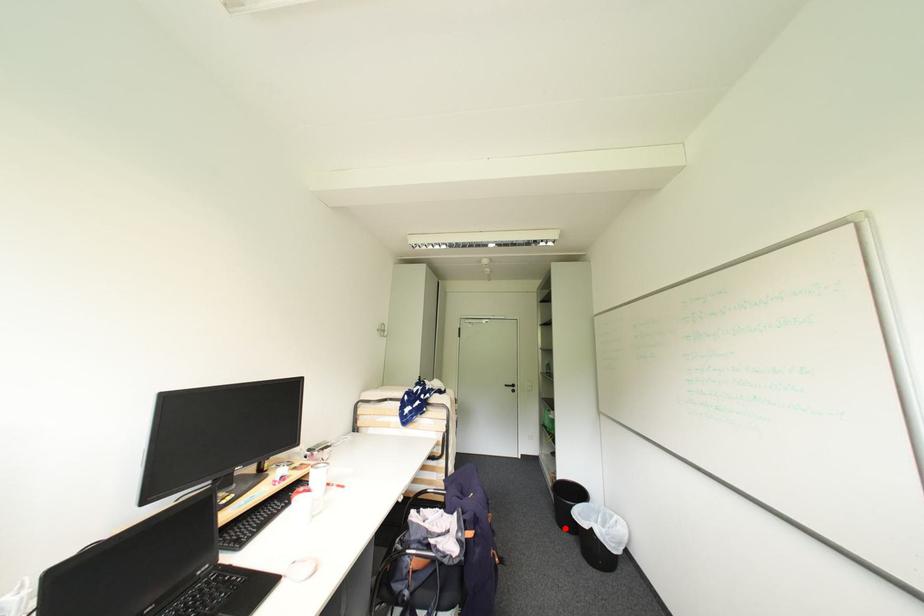
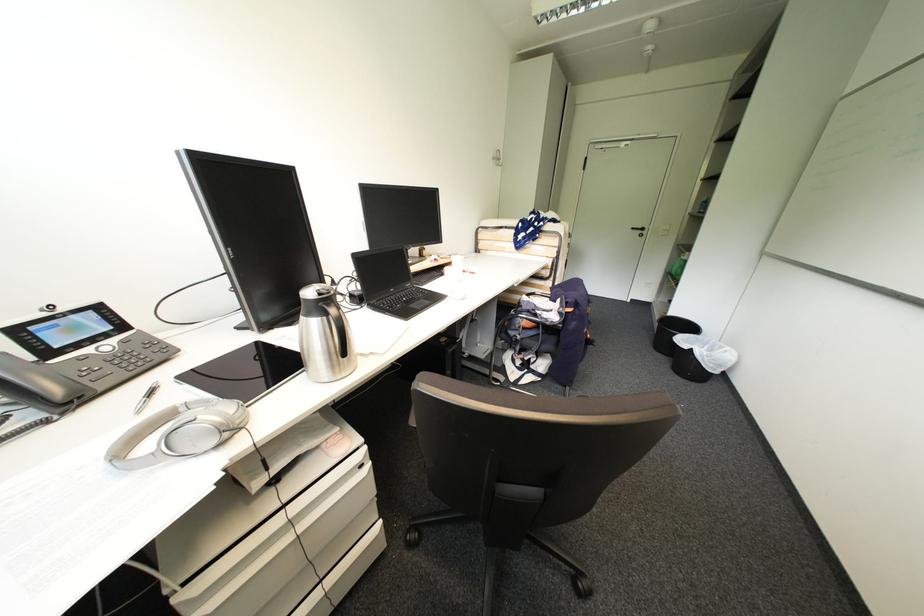
Question: A red point is marked in image1. In image2, is the corresponding 3D point closer to the camera or farther? Reply with the corresponding letter.

Choices:
 (A) The corresponding 3D point is closer.
 (B) The corresponding 3D point is farther.

Answer: (A)